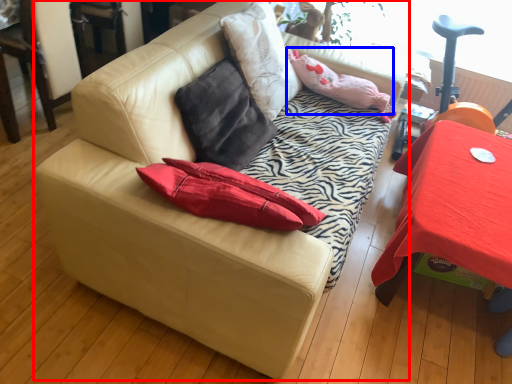
Question: Among these objects, which one is nearest to the camera, studio couch (highlighted by a red box) or pillow (highlighted by a blue box)?

Choices:
 (A) studio couch
 (B) pillow

Answer: (A)